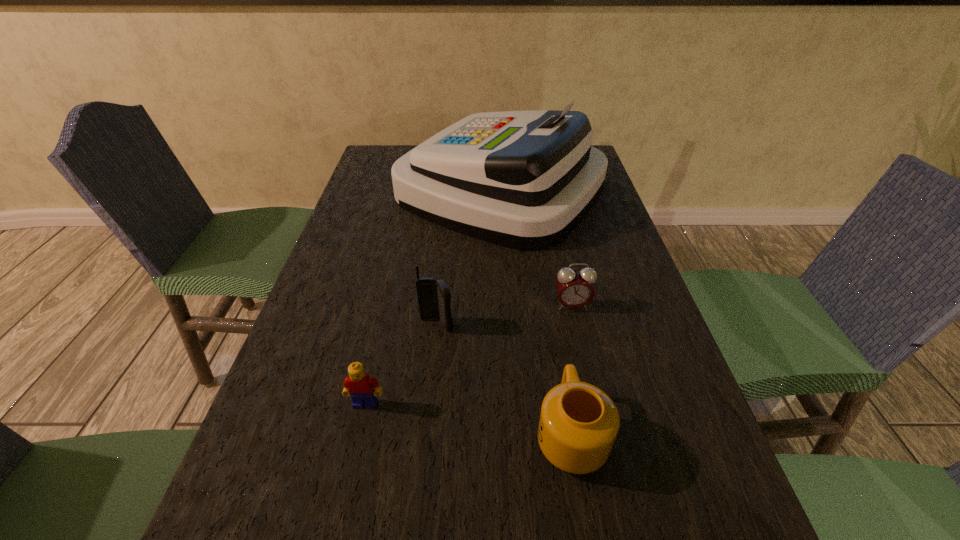
This screenshot has height=540, width=960. I want to click on free spot located on the handle side of the mug, so click(x=542, y=266).

The width and height of the screenshot is (960, 540). Identify the location of vacant space situated 0.070m on the handle side of the mug. (559, 363).

Where is `free space located 0.270m on the handle side of the mug`? This screenshot has height=540, width=960. free space located 0.270m on the handle side of the mug is located at coordinates (547, 293).

In order to click on vacant area located 0.200m on the face of the Lego in this screenshot , I will do `click(337, 531)`.

Locate an element on the screen. The image size is (960, 540). object at the far edge is located at coordinates (524, 180).

Identify the location of cash register present at the left edge. (524, 180).

Identify the location of Lego that is at the left edge. This screenshot has height=540, width=960. (359, 385).

I want to click on cash register that is positioned at the right edge, so click(524, 180).

Find the location of a particular element. Image resolution: width=960 pixels, height=540 pixels. alarm clock that is at the right edge is located at coordinates (575, 289).

Locate an element on the screen. The width and height of the screenshot is (960, 540). object located at the far left corner is located at coordinates (524, 180).